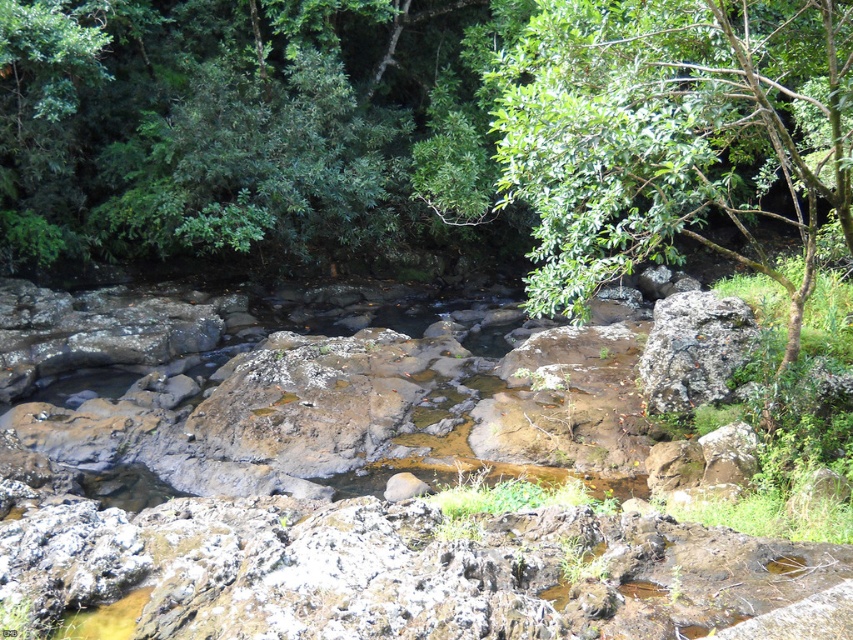
Question: Is green leafy tree at upper right wider than rusty metallic boulder at right?

Choices:
 (A) no
 (B) yes

Answer: (B)

Question: Is green leafy tree at upper right further to camera compared to rusty metallic boulder at right?

Choices:
 (A) yes
 (B) no

Answer: (B)

Question: Which object is farther from the camera taking this photo?

Choices:
 (A) green leafy tree at upper right
 (B) rusty metallic boulder at right

Answer: (B)

Question: Can you confirm if green leafy tree at upper right is positioned to the left of rusty metallic boulder at right?

Choices:
 (A) yes
 (B) no

Answer: (B)